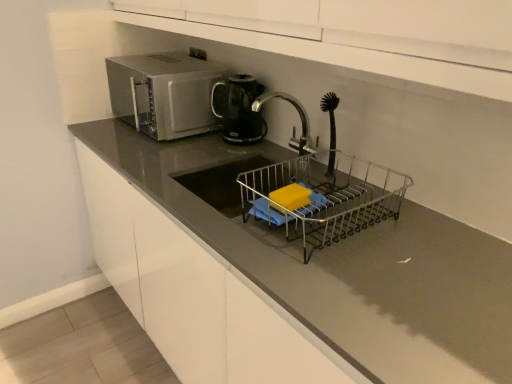
Question: Is matte gray countertop at center far away from metallic wire dish rack at center?

Choices:
 (A) no
 (B) yes

Answer: (A)

Question: Can we say matte gray countertop at center lies outside metallic wire dish rack at center?

Choices:
 (A) no
 (B) yes

Answer: (B)

Question: Considering the relative sizes of matte gray countertop at center and metallic wire dish rack at center in the image provided, is matte gray countertop at center wider than metallic wire dish rack at center?

Choices:
 (A) yes
 (B) no

Answer: (A)

Question: Is matte gray countertop at center aimed at metallic wire dish rack at center?

Choices:
 (A) yes
 (B) no

Answer: (B)

Question: Is matte gray countertop at center turned away from metallic wire dish rack at center?

Choices:
 (A) yes
 (B) no

Answer: (B)

Question: From the image's perspective, is yellow sponge at sink above or below silver metallic tap at center?

Choices:
 (A) above
 (B) below

Answer: (B)

Question: From a real-world perspective, is yellow sponge at sink positioned above or below silver metallic tap at center?

Choices:
 (A) below
 (B) above

Answer: (A)

Question: Looking at their shapes, would you say yellow sponge at sink is wider or thinner than silver metallic tap at center?

Choices:
 (A) wide
 (B) thin

Answer: (B)

Question: Is yellow sponge at sink taller or shorter than silver metallic tap at center?

Choices:
 (A) short
 (B) tall

Answer: (A)

Question: Is point (138, 119) positioned closer to the camera than point (276, 163)?

Choices:
 (A) closer
 (B) farther

Answer: (B)

Question: Relative to metallic wire dish rack at center, is satin silver microwave at upper left in front or behind?

Choices:
 (A) front
 (B) behind

Answer: (B)

Question: From the image's perspective, is satin silver microwave at upper left located above or below metallic wire dish rack at center?

Choices:
 (A) above
 (B) below

Answer: (A)

Question: In terms of height, does satin silver microwave at upper left look taller or shorter compared to metallic wire dish rack at center?

Choices:
 (A) tall
 (B) short

Answer: (A)

Question: From their relative heights in the image, would you say yellow sponge at sink is taller or shorter than metallic wire dish rack at center?

Choices:
 (A) tall
 (B) short

Answer: (B)

Question: Is yellow sponge at sink inside the boundaries of metallic wire dish rack at center, or outside?

Choices:
 (A) inside
 (B) outside

Answer: (A)